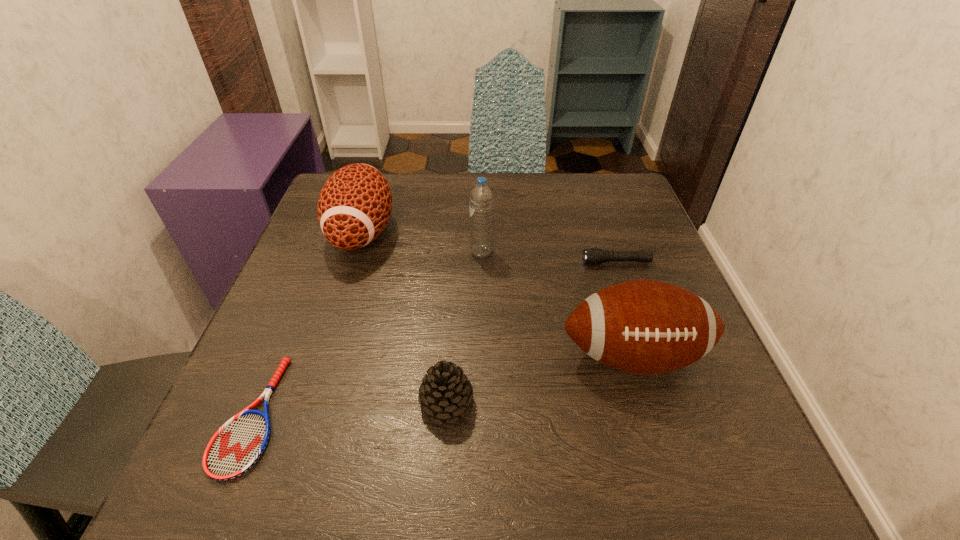
Where is `vacant area located 0.360m at the lens end of the second shortest object`? Image resolution: width=960 pixels, height=540 pixels. vacant area located 0.360m at the lens end of the second shortest object is located at coordinates (418, 262).

Image resolution: width=960 pixels, height=540 pixels. I want to click on vacant space located 0.130m at the lens end of the second shortest object, so click(523, 262).

The image size is (960, 540). What are the coordinates of `vacant space situated 0.260m at the lens end of the second shortest object` in the screenshot? It's located at (464, 262).

Locate an element on the screen. vacant space located 0.310m on the back of the tennis racket is located at coordinates (322, 249).

You are a GUI agent. You are given a task and a screenshot of the screen. Output one action in this format:
    pyautogui.click(x=<x>, y=<y>)
    Task: Click on the object at the far edge
    Image resolution: width=960 pixels, height=540 pixels.
    Given the screenshot: What is the action you would take?
    coord(354,206)

Where is `object located at the near edge`? Image resolution: width=960 pixels, height=540 pixels. object located at the near edge is located at coordinates (238, 444).

At what (x,y) coordinates should I click in order to perform the action: click on football located at the left edge. Please return your answer as a coordinate pair (x, y). Image resolution: width=960 pixels, height=540 pixels. Looking at the image, I should click on (354, 206).

Where is `tennis racket present at the left edge`? tennis racket present at the left edge is located at coordinates (238, 444).

Find the location of `football that is positioned at the right edge`. football that is positioned at the right edge is located at coordinates (647, 327).

Image resolution: width=960 pixels, height=540 pixels. Identify the location of flashlight present at the right edge. (593, 256).